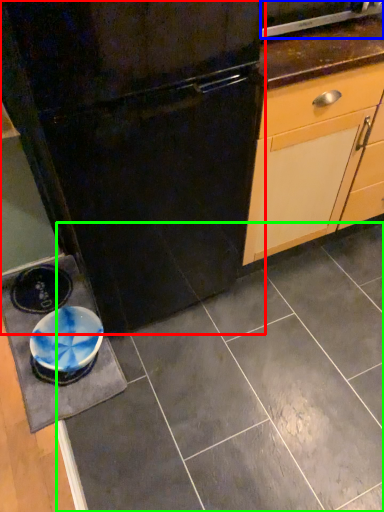
Question: Which object is the closest to the refrigerator (highlighted by a red box)? Choose among these: home appliance (highlighted by a blue box) or ceramic tile (highlighted by a green box).

Choices:
 (A) home appliance
 (B) ceramic tile

Answer: (A)